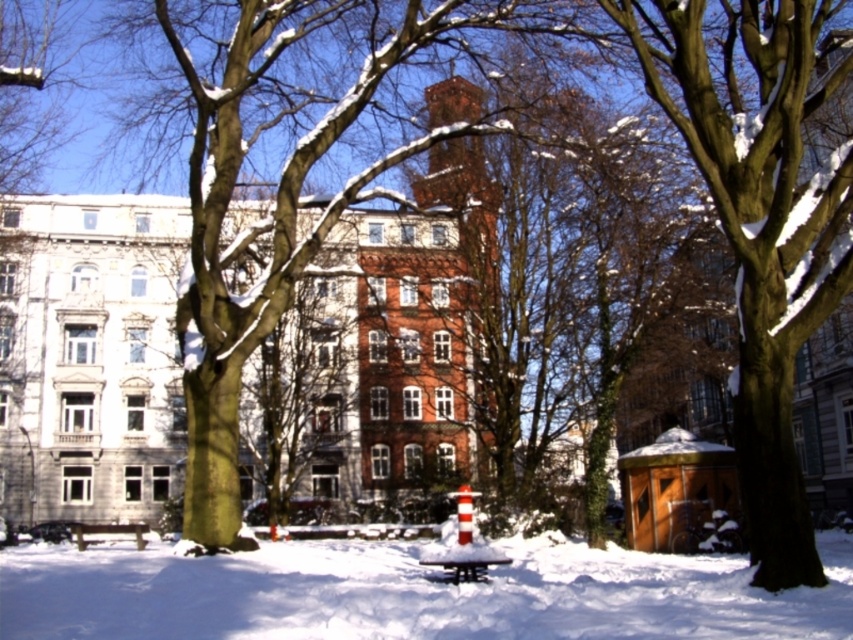
Question: Among these points, which one is farthest from the camera?

Choices:
 (A) (370, 556)
 (B) (451, 563)

Answer: (A)

Question: Which of the following is the farthest from the observer?

Choices:
 (A) wooden park bench at center
 (B) white fluffy snow at center

Answer: (A)

Question: Is white fluffy snow at center bigger than wooden park bench at center?

Choices:
 (A) yes
 (B) no

Answer: (A)

Question: Which of the following is the closest to the observer?

Choices:
 (A) white fluffy snow at center
 (B) wooden park bench at center

Answer: (A)

Question: Is white fluffy snow at center bigger than wooden park bench at center?

Choices:
 (A) no
 (B) yes

Answer: (B)

Question: Can you confirm if white fluffy snow at center is positioned to the right of wooden park bench at center?

Choices:
 (A) no
 (B) yes

Answer: (A)